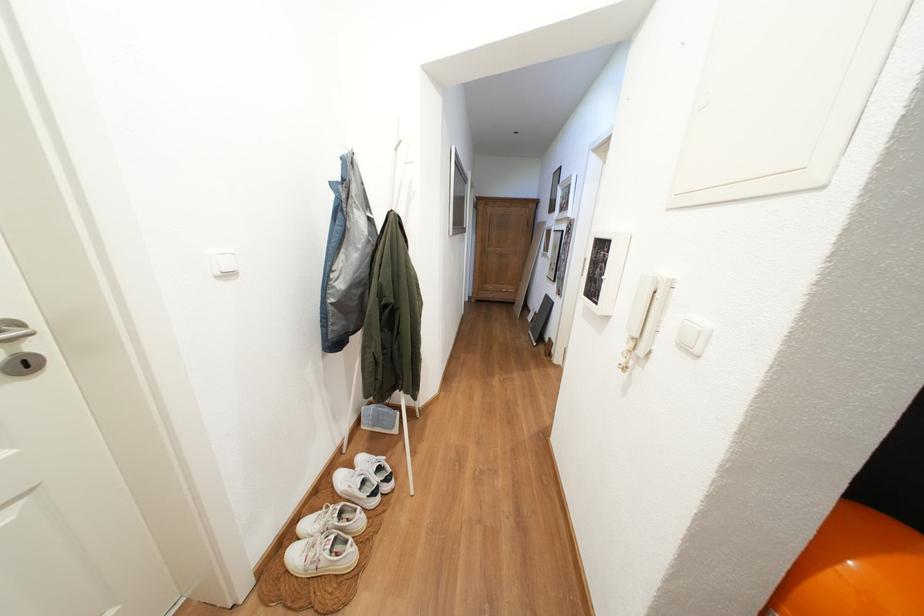
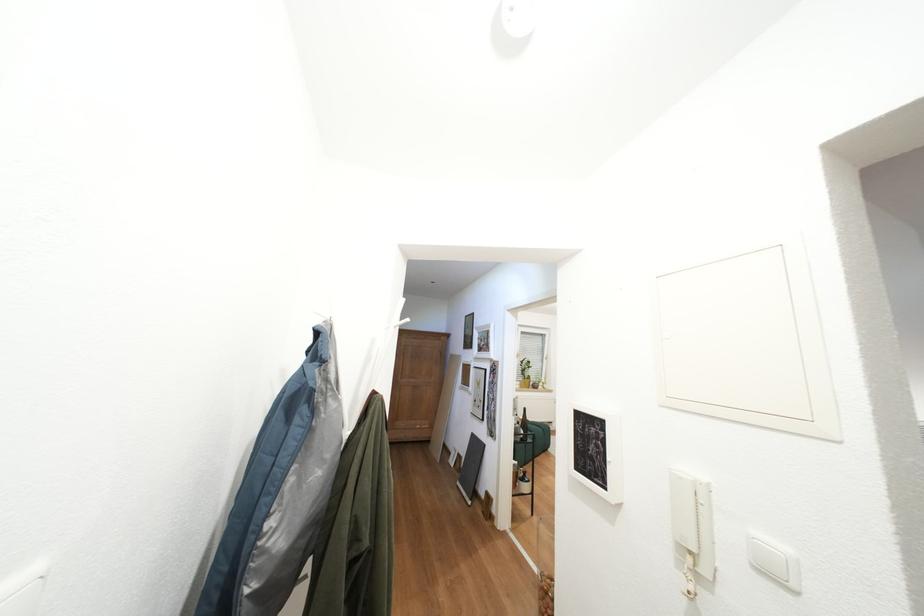
How did the camera likely rotate?

The camera rotated toward right-up.